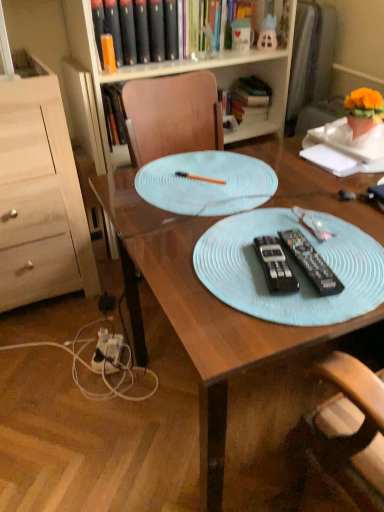
Locate an element on the screen. This screenshot has height=512, width=384. vacant space that is in between black plastic remote control at center, the 2th remote control positioned from the left, and light blue textured placemat at upper center is located at coordinates (261, 231).